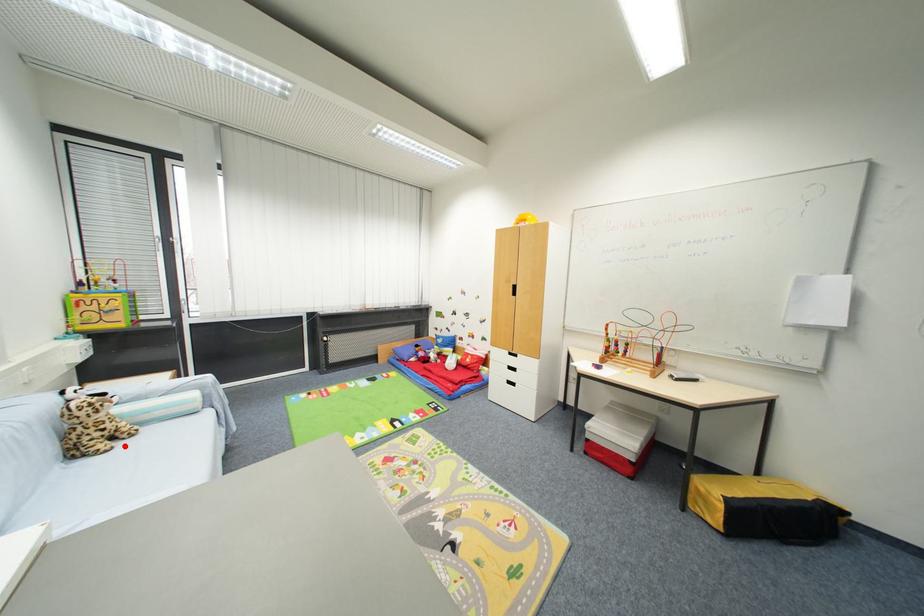
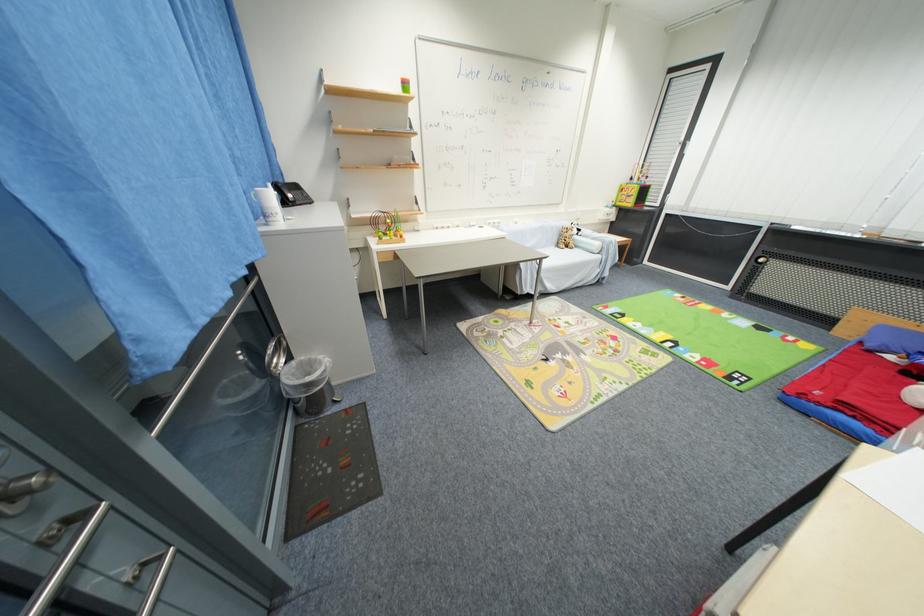
Find the pixel in the second image that matches the highlighted location in the first image.

(572, 251)